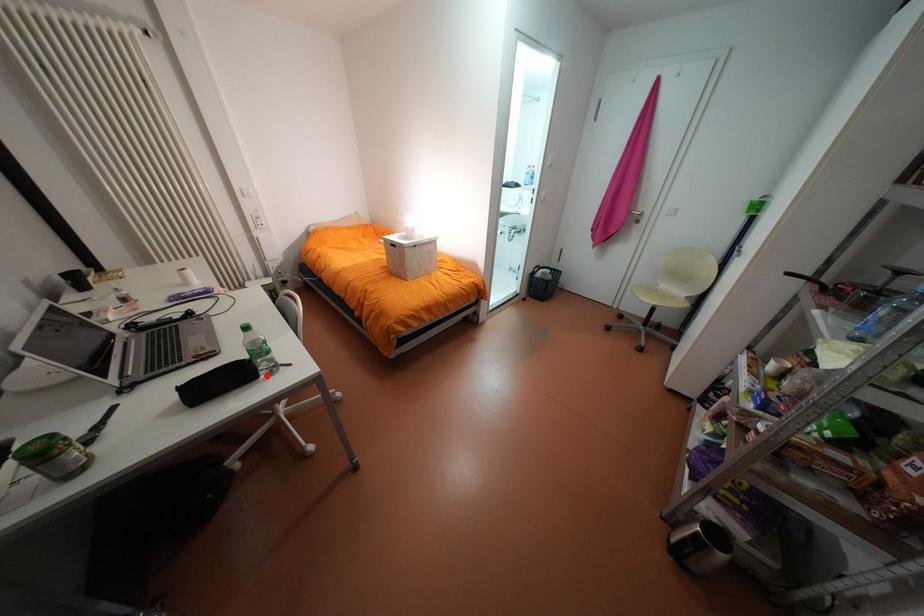
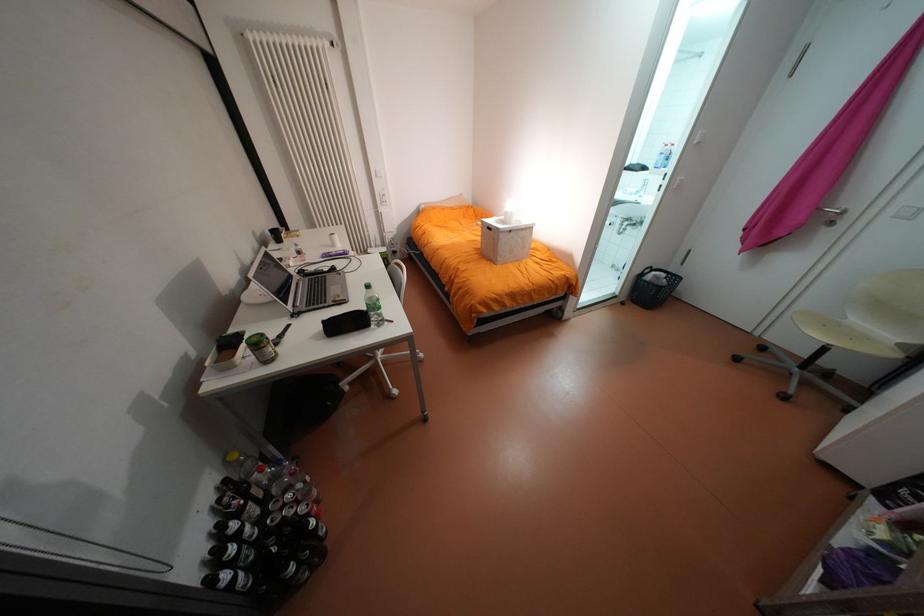
Find the pixel in the second image that matches the highlighted location in the first image.

(379, 325)